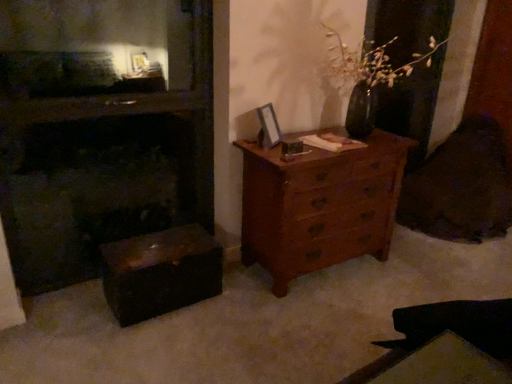
Question: In terms of height, does wooden chest of drawers at right look taller or shorter compared to dark wood fireplace at left?

Choices:
 (A) tall
 (B) short

Answer: (B)

Question: From the image's perspective, is wooden chest of drawers at right above or below dark wood fireplace at left?

Choices:
 (A) below
 (B) above

Answer: (A)

Question: Which of these objects is positioned farthest from the wooden picture frame at upper center?

Choices:
 (A) dark wood fireplace at left
 (B) wooden chest of drawers at right
 (C) shiny dark wood trunk at lower left

Answer: (A)

Question: Estimate the real-world distances between objects in this image. Which object is farther from the dark wood fireplace at left?

Choices:
 (A) shiny dark wood trunk at lower left
 (B) wooden chest of drawers at right
 (C) wooden picture frame at upper center

Answer: (C)